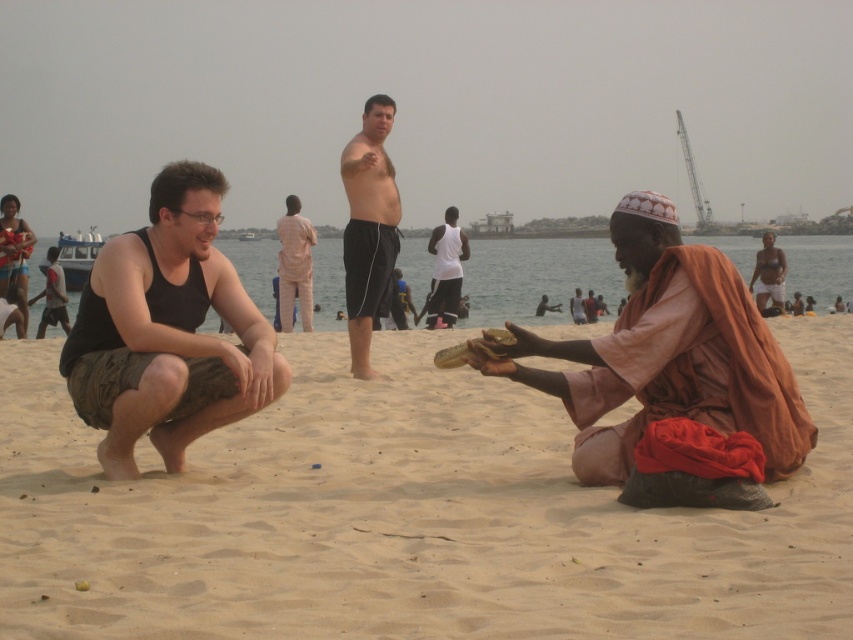
Between black cotton tank top at left and shiny black shorts at center, which one appears on the right side from the viewer's perspective?

shiny black shorts at center is more to the right.

Which is more to the left, black cotton tank top at left or shiny black shorts at center?

Positioned to the left is black cotton tank top at left.

The width and height of the screenshot is (853, 640). What are the coordinates of `black cotton tank top at left` in the screenshot? It's located at (167, 330).

Where is `orange fabric cloth at lower right`? orange fabric cloth at lower right is located at coordinates (666, 355).

Does orange fabric cloth at lower right have a smaller size compared to white matte shirt at center?

Yes, orange fabric cloth at lower right is smaller than white matte shirt at center.

Describe the element at coordinates (666, 355) in the screenshot. I see `orange fabric cloth at lower right` at that location.

The image size is (853, 640). Find the location of `orange fabric cloth at lower right`. orange fabric cloth at lower right is located at coordinates (666, 355).

Between black cotton tank top at left and smooth skin man at right, which one appears on the right side from the viewer's perspective?

Positioned to the right is smooth skin man at right.

Identify the location of black cotton tank top at left. The height and width of the screenshot is (640, 853). (167, 330).

Measure the distance between black cotton tank top at left and camera.

black cotton tank top at left and camera are 6.06 meters apart.

At what (x,y) coordinates should I click in order to perform the action: click on black cotton tank top at left. Please return your answer as a coordinate pair (x, y). The width and height of the screenshot is (853, 640). Looking at the image, I should click on (167, 330).